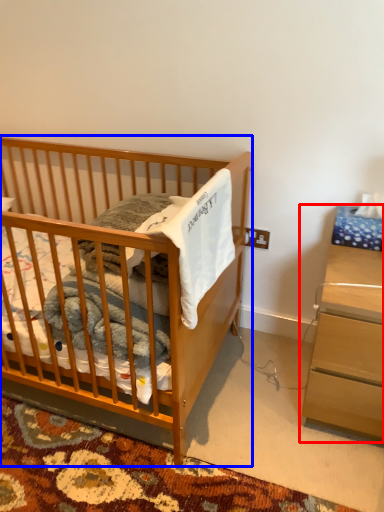
Question: Among these objects, which one is farthest to the camera, nightstand (highlighted by a red box) or infant bed (highlighted by a blue box)?

Choices:
 (A) nightstand
 (B) infant bed

Answer: (A)